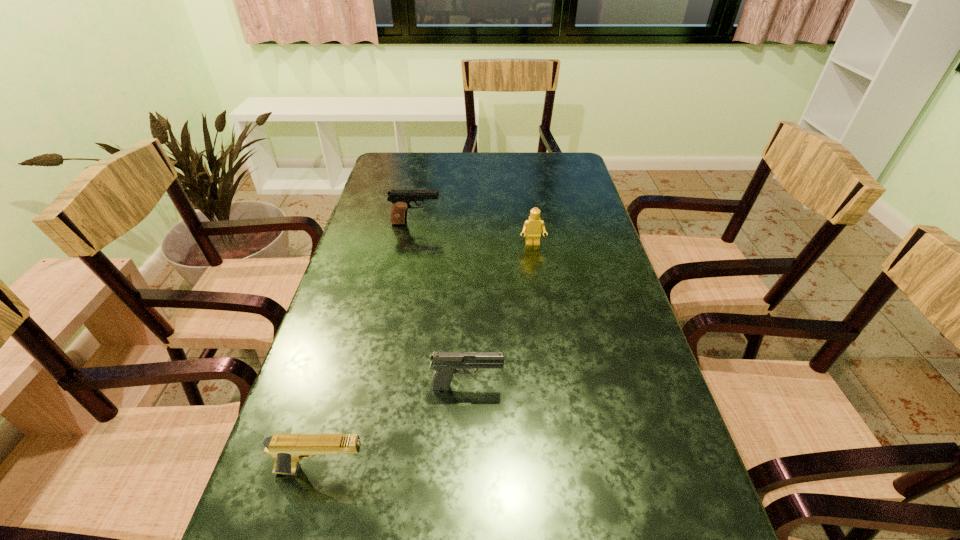
Find the location of a particular element. Image resolution: width=960 pixels, height=540 pixels. the farthest object is located at coordinates (401, 199).

At what (x,y) coordinates should I click in order to perform the action: click on Lego. Please return your answer as a coordinate pair (x, y). Image resolution: width=960 pixels, height=540 pixels. Looking at the image, I should click on (532, 226).

You are a GUI agent. You are given a task and a screenshot of the screen. Output one action in this format:
    pyautogui.click(x=<x>, y=<y>)
    Task: Click on the rightmost object
    
    Given the screenshot: What is the action you would take?
    pyautogui.click(x=532, y=226)

Locate an element on the screen. the third farthest object is located at coordinates (444, 364).

What are the coordinates of `the rightmost pistol` in the screenshot? It's located at (444, 364).

The height and width of the screenshot is (540, 960). Identify the location of the nearest object. (287, 449).

Where is `vacant space located at the barrel of the farthest pistol`? This screenshot has width=960, height=540. vacant space located at the barrel of the farthest pistol is located at coordinates (548, 224).

Image resolution: width=960 pixels, height=540 pixels. Find the location of `free point located on the face of the rightmost object`. free point located on the face of the rightmost object is located at coordinates (546, 332).

Locate an element on the screen. Image resolution: width=960 pixels, height=540 pixels. vacant space located aim along the barrel of the second farthest pistol is located at coordinates (594, 386).

Locate an element on the screen. vacant area situated at the barrel of the nearest object is located at coordinates (562, 470).